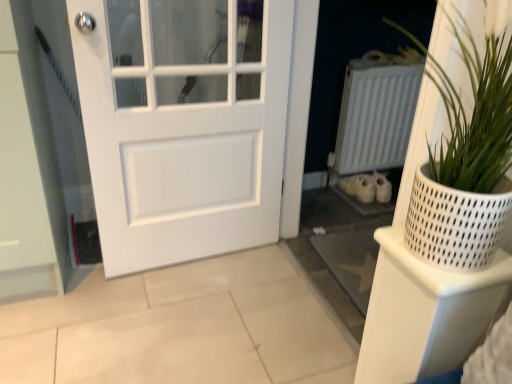
Where is `space that is in front of white matte door at center`? The width and height of the screenshot is (512, 384). space that is in front of white matte door at center is located at coordinates (177, 319).